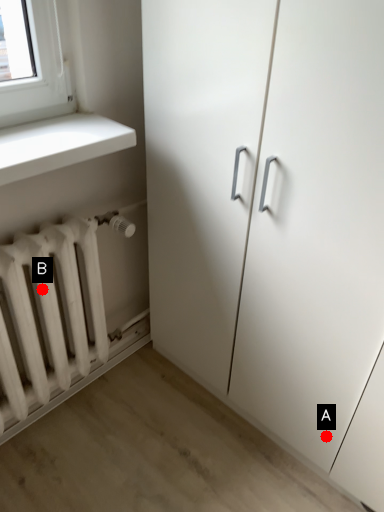
Question: Two points are circled on the image, labeled by A and B beside each circle. Which point appears closest to the camera in this image?

Choices:
 (A) A is closer
 (B) B is closer

Answer: (B)